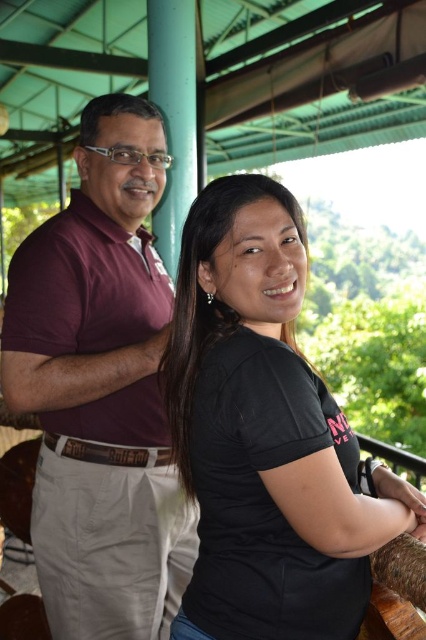
You are a photographer setting up for a group photo. You need to position two subjects so that one is to the right of the other. Given the current arrangement of the black matte shirt at center and maroon cotton shirt at left, which subject should you move to achieve this?

The black matte shirt at center is already to the right of the maroon cotton shirt at left, so no movement is needed as the current arrangement already satisfies the requirement.

You are standing at the point labeled as point (304, 396) in the image. You want to take a photo of the two people under the green metal roof using a camera that has a 50mm focal length. Given that the camera is 34.60 inches away from the point, will the two people be fully visible in the photo?

The camera is 34.60 inches away from the point labeled as point (304, 396), so the two people under the green metal roof will be fully visible in the photo taken with a 50mm focal length.

You are standing in a park and see two people. The man is on the left wearing a maroon polo shirt, and the woman is on the right wearing a black T shirt. There is a point at coordinates (265, 435). Based on the scene, what object or feature does this coordinate most likely correspond to?

The point at coordinates (265, 435) corresponds to the black matte shirt at center.